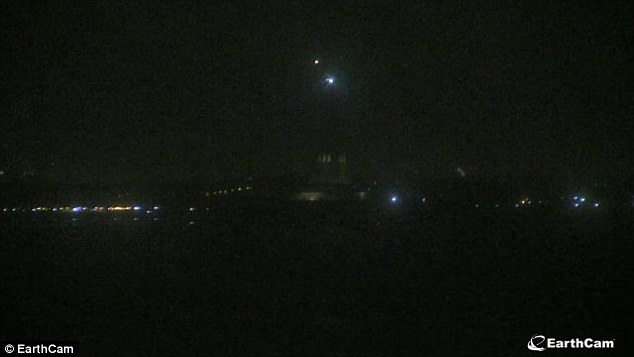
Locate an element on the screen. The height and width of the screenshot is (357, 634). yellow lights is located at coordinates (226, 190).